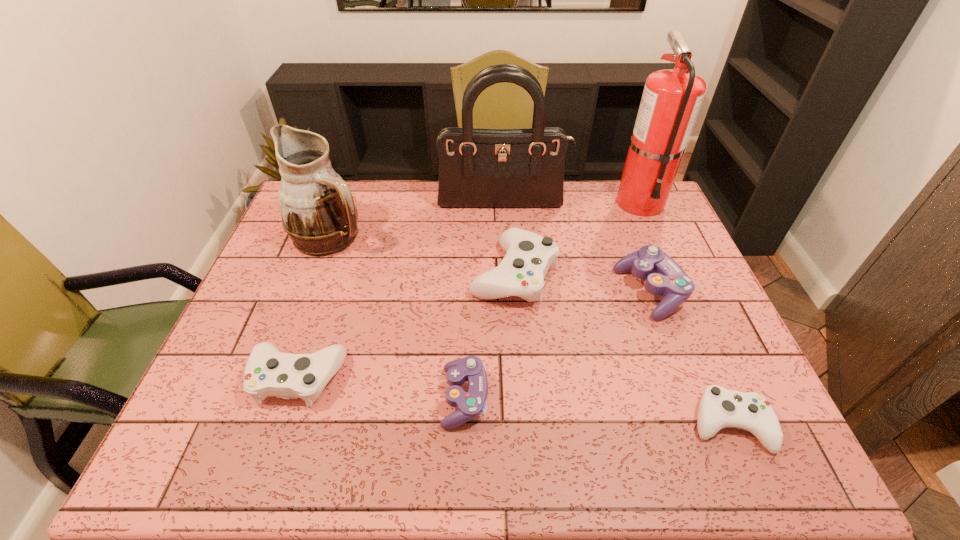
This screenshot has height=540, width=960. What are the coordinates of `the left purple control` in the screenshot? It's located at (470, 405).

What are the coordinates of `the nearer purple control` in the screenshot? It's located at (470, 405).

Where is `the shortest control`? the shortest control is located at coordinates (719, 408).

Locate an element on the screen. the smallest white control is located at coordinates (719, 408).

Where is `free location located 0.300m at the nozzle of the red fire extinguisher`? free location located 0.300m at the nozzle of the red fire extinguisher is located at coordinates (x=678, y=289).

Locate an element on the screen. This screenshot has width=960, height=540. free spot located with an open clasp on the front of the black handbag is located at coordinates (506, 251).

The image size is (960, 540). I want to click on blank space located 0.230m from the spout of the brown pitcher, so click(444, 236).

What are the coordinates of `vacant space located 0.360m on the left of the second white control from right to left` in the screenshot? It's located at (346, 274).

This screenshot has width=960, height=540. Identify the location of vacant space positioned 0.400m on the left of the bigger purple control. (475, 292).

Identify the location of free space located 0.380m on the back of the leftmost control. This screenshot has width=960, height=540. (342, 248).